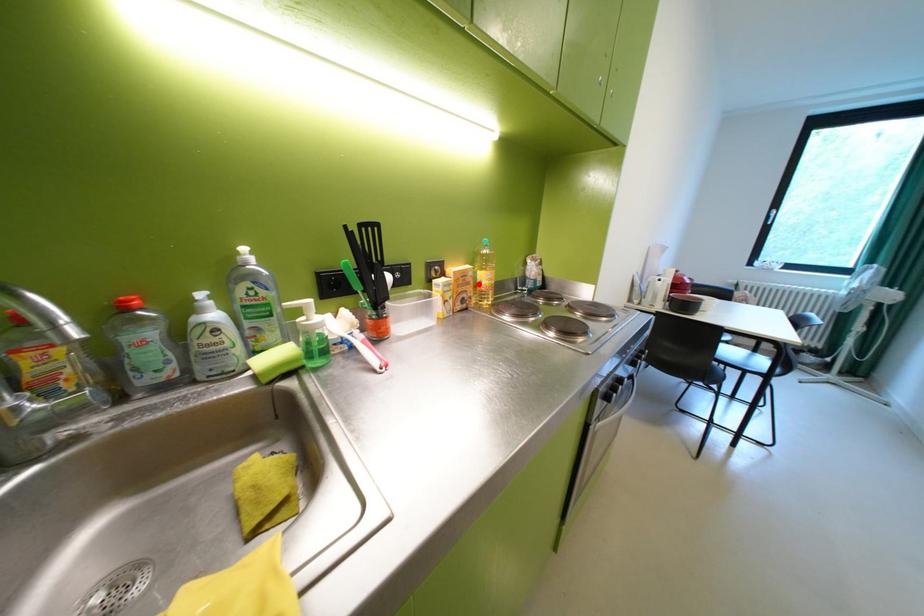
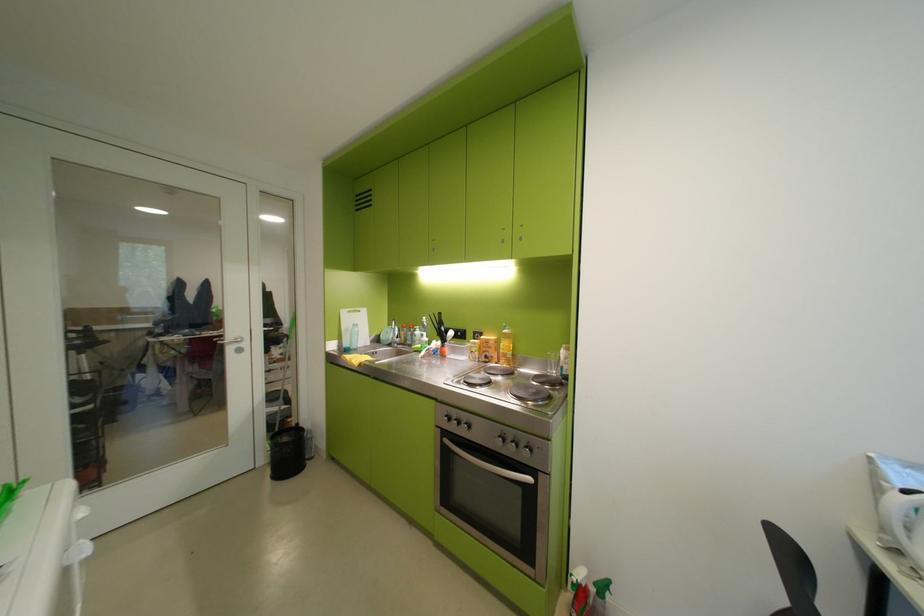
In the second image, find the point that corresponds to the highlighted location in the first image.

(501, 349)